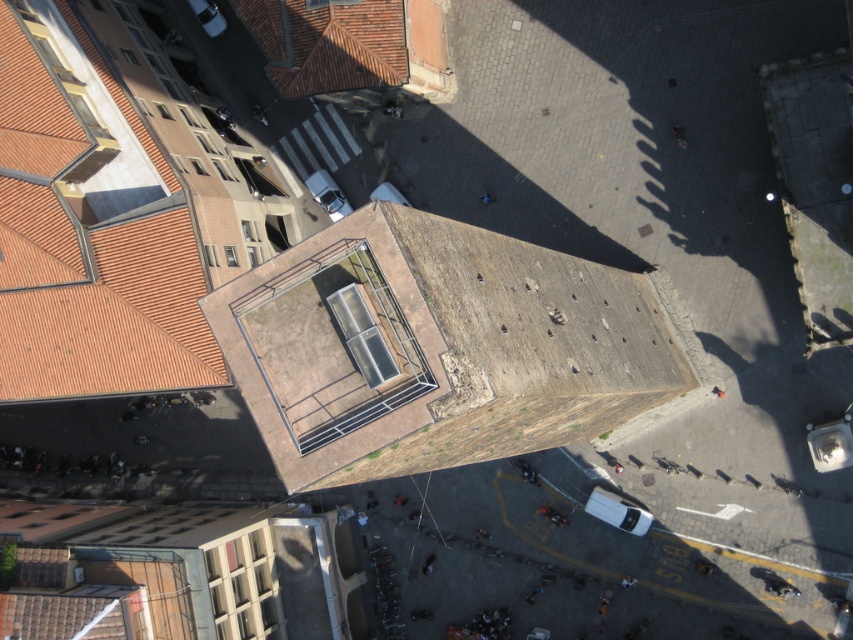
What are the coordinates of the brown textured roof at center in the image?

The coordinates of the brown textured roof at center are at point (434, 348).

You are a city planner reviewing this aerial image. You need to determine which of the two roofs, the brown textured roof at center or the terracotta tiles at upper left, requires more material for repairs. Based on the image, which one would you prioritize for more resources?

The brown textured roof at center is larger in size than terracotta tiles at upper left, so it would require more material for repairs and should be prioritized for more resources.